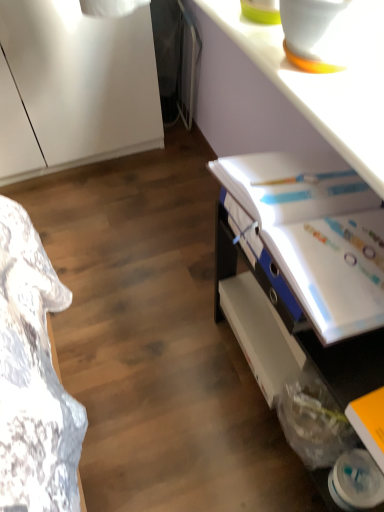
Identify the location of free space above white glossy counter top at upper right (from a real-world perspective). Image resolution: width=384 pixels, height=512 pixels. (301, 53).